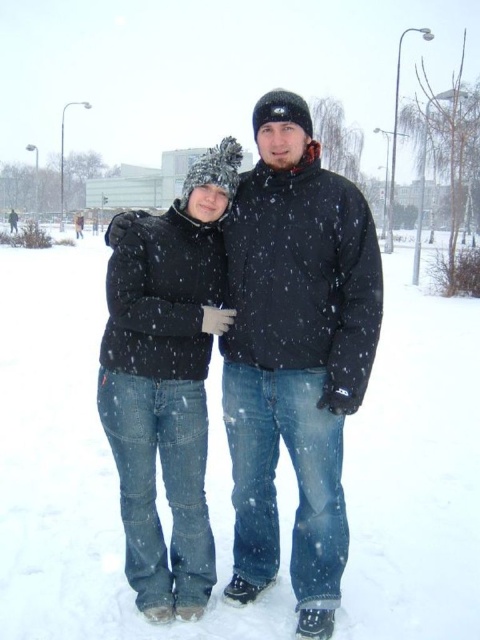
Question: Does matte black jacket at center appear under black puffy jacket at left?

Choices:
 (A) no
 (B) yes

Answer: (A)

Question: Can you confirm if matte black jacket at center is positioned above black puffy jacket at left?

Choices:
 (A) yes
 (B) no

Answer: (A)

Question: Which of the following is the farthest from the observer?

Choices:
 (A) black puffy jacket at left
 (B) matte black jacket at center

Answer: (A)

Question: In this image, where is matte black jacket at center located relative to black puffy jacket at left?

Choices:
 (A) above
 (B) below

Answer: (A)

Question: Which object appears closest to the camera in this image?

Choices:
 (A) matte black jacket at center
 (B) black puffy jacket at left

Answer: (A)